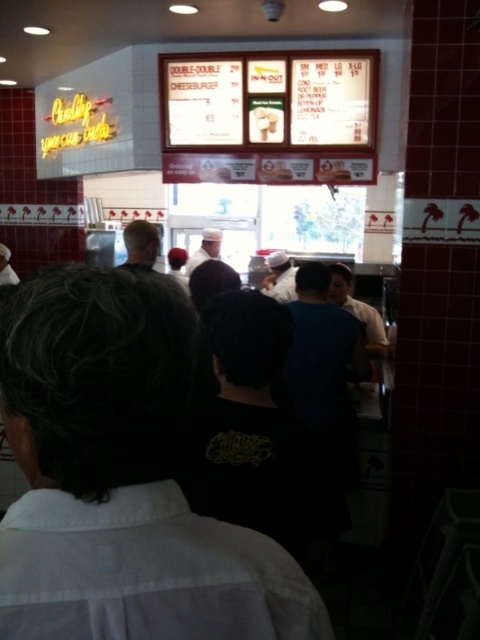
Who is more distant from viewer, (66, 440) or (196, 460)?

Point (196, 460)

Describe the element at coordinates (120, 476) in the screenshot. I see `black shirt at center` at that location.

Locate an element on the screen. The height and width of the screenshot is (640, 480). black shirt at center is located at coordinates (120, 476).